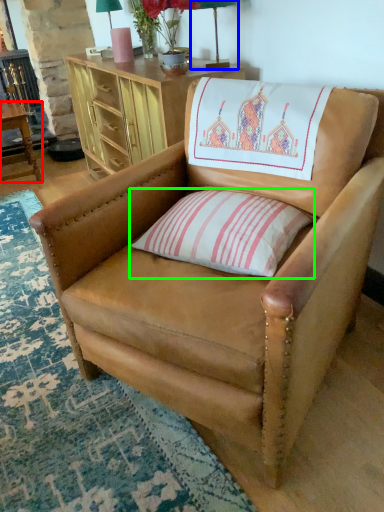
Question: Which object is the farthest from table (highlighted by a red box)? Choose among these: table lamp (highlighted by a blue box) or pillow (highlighted by a green box).

Choices:
 (A) table lamp
 (B) pillow

Answer: (B)